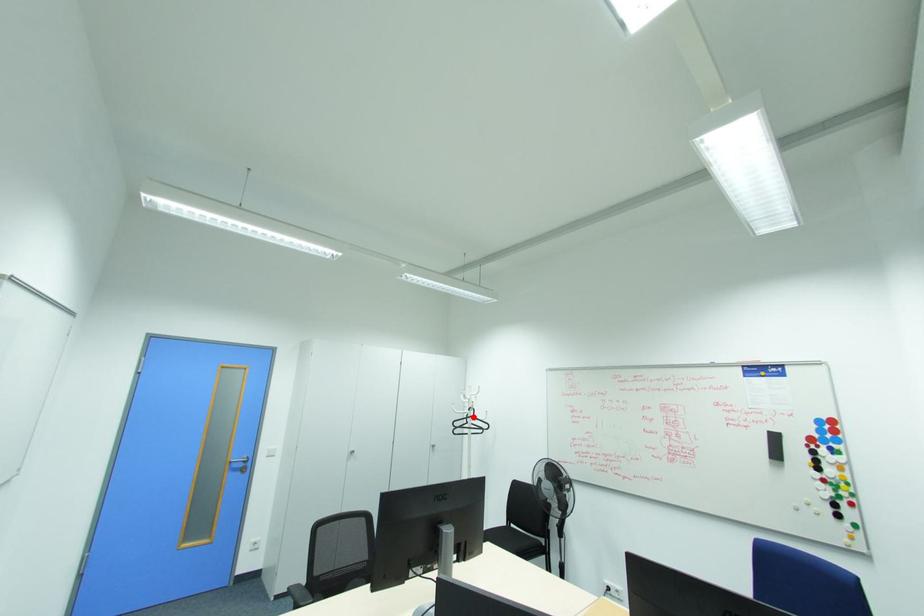
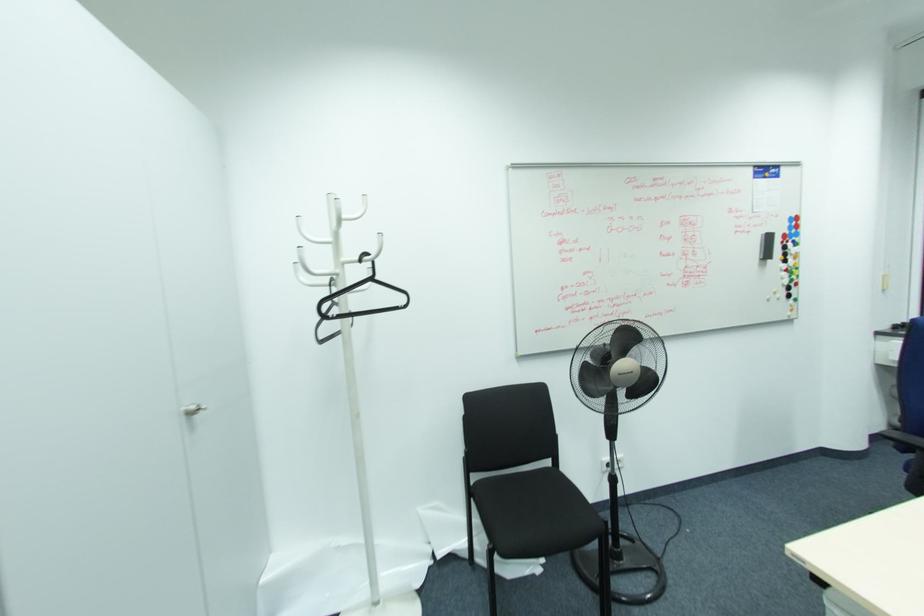
Question: I am providing you with two images of the same scene from different viewpoints. In image1, a red point is highlighted. Considering the same 3D point in image2, which of the following is correct?

Choices:
 (A) It is closer
 (B) It is farther

Answer: (A)